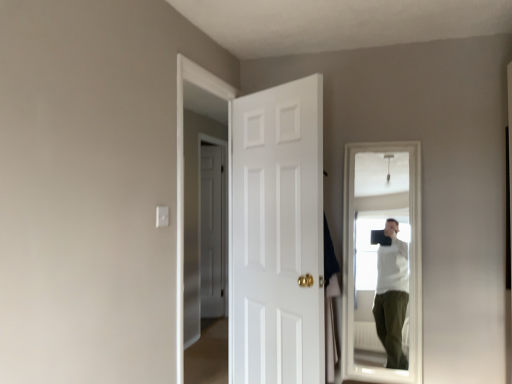
This screenshot has height=384, width=512. Find the location of `white painted wood door at center, which is counted as the first door, starting from the front`. white painted wood door at center, which is counted as the first door, starting from the front is located at coordinates (277, 236).

Describe the element at coordinates (277, 236) in the screenshot. I see `white painted wood door at center, which is the 2th door in back-to-front order` at that location.

How much space does white matte door at center, which is counted as the second door, starting from the right, occupy vertically?

It is 2.15 meters.

Describe the element at coordinates (213, 230) in the screenshot. I see `white matte door at center, the 1th door viewed from the left` at that location.

This screenshot has height=384, width=512. Identify the location of white matte door at center, the 2th door when ordered from front to back. (213, 230).

I want to click on white painted wood door at center, the 2th door in the left-to-right sequence, so tap(277, 236).

Which is more to the left, white matte door at center, which is counted as the second door, starting from the right, or white painted wood door at center, which is the 2th door in back-to-front order?

From the viewer's perspective, white matte door at center, which is counted as the second door, starting from the right, appears more on the left side.

From the picture: Is white matte door at center, the 1th door viewed from the left, further to camera compared to white painted wood door at center, which is counted as the first door, starting from the front?

Yes, white matte door at center, the 1th door viewed from the left, is further from the camera.

Does point (210, 316) come closer to viewer compared to point (300, 91)?

No.

From the image's perspective, does white matte door at center, the 2th door when ordered from front to back, appear higher than white painted wood door at center, which is the 1th door from right to left?

Incorrect, from the image's perspective, white matte door at center, the 2th door when ordered from front to back, is lower than white painted wood door at center, which is the 1th door from right to left.

Based on the photo, from a real-world perspective, is white matte door at center, which ranks as the first door in back-to-front order, positioned above or below white painted wood door at center, which is counted as the first door, starting from the front?

In terms of real-world spatial position, white matte door at center, which ranks as the first door in back-to-front order, is below white painted wood door at center, which is counted as the first door, starting from the front.

Can you confirm if white matte door at center, the 2th door when ordered from front to back, is wider than white painted wood door at center, which is the 2th door in back-to-front order?

Incorrect, the width of white matte door at center, the 2th door when ordered from front to back, does not surpass that of white painted wood door at center, which is the 2th door in back-to-front order.

Considering the sizes of white matte door at center, which ranks as the first door in back-to-front order, and white painted wood door at center, which is the 1th door from right to left, in the image, is white matte door at center, which ranks as the first door in back-to-front order, taller or shorter than white painted wood door at center, which is the 1th door from right to left,?

In the image, white matte door at center, which ranks as the first door in back-to-front order, appears to be taller than white painted wood door at center, which is the 1th door from right to left.

Can you confirm if white matte door at center, which is counted as the second door, starting from the right, is smaller than white painted wood door at center, which is the 2th door in back-to-front order?

Correct, white matte door at center, which is counted as the second door, starting from the right, occupies less space than white painted wood door at center, which is the 2th door in back-to-front order.

Do you think white matte door at center, which is counted as the second door, starting from the right, is within white painted wood door at center, which is the 1th door from right to left, or outside of it?

white matte door at center, which is counted as the second door, starting from the right, is not enclosed by white painted wood door at center, which is the 1th door from right to left.

Is white matte door at center, the 1th door viewed from the left, touching white painted wood door at center, the 2th door in the left-to-right sequence?

No, white matte door at center, the 1th door viewed from the left, is not in contact with white painted wood door at center, the 2th door in the left-to-right sequence.

Is white painted wood door at center, the 2th door in the left-to-right sequence, at the back of white matte door at center, which is counted as the second door, starting from the right?

white matte door at center, which is counted as the second door, starting from the right, is not turned away from white painted wood door at center, the 2th door in the left-to-right sequence.

Can you tell me how much white matte door at center, the 2th door when ordered from front to back, and white painted wood door at center, which is counted as the first door, starting from the front, differ in facing direction?

The facing directions of white matte door at center, the 2th door when ordered from front to back, and white painted wood door at center, which is counted as the first door, starting from the front, are 125 degrees apart.

The image size is (512, 384). Find the location of `door that is on the left side of white painted wood door at center, the 2th door in the left-to-right sequence`. door that is on the left side of white painted wood door at center, the 2th door in the left-to-right sequence is located at coordinates (213, 230).

Which is more to the left, white painted wood door at center, which is the 2th door in back-to-front order, or white matte door at center, which is counted as the second door, starting from the right?

white matte door at center, which is counted as the second door, starting from the right.

Between white painted wood door at center, which is the 1th door from right to left, and white matte door at center, which ranks as the first door in back-to-front order, which one is positioned in front?

Positioned in front is white painted wood door at center, which is the 1th door from right to left.

From the picture: Which point is more distant from viewer, (306, 305) or (224, 261)?

The point (224, 261) is behind.

From the image's perspective, is white painted wood door at center, the 2th door in the left-to-right sequence, positioned above or below white matte door at center, the 2th door when ordered from front to back?

Based on their image positions, white painted wood door at center, the 2th door in the left-to-right sequence, is located above white matte door at center, the 2th door when ordered from front to back.

From a real-world perspective, is white painted wood door at center, which is the 1th door from right to left, physically located above or below white matte door at center, the 2th door when ordered from front to back?

white painted wood door at center, which is the 1th door from right to left, is above white matte door at center, the 2th door when ordered from front to back.

In the scene shown: Is white painted wood door at center, which is the 1th door from right to left, thinner than white matte door at center, which ranks as the first door in back-to-front order?

Incorrect, the width of white painted wood door at center, which is the 1th door from right to left, is not less than that of white matte door at center, which ranks as the first door in back-to-front order.

Considering the sizes of white painted wood door at center, which is the 2th door in back-to-front order, and white matte door at center, which ranks as the first door in back-to-front order, in the image, is white painted wood door at center, which is the 2th door in back-to-front order, taller or shorter than white matte door at center, which ranks as the first door in back-to-front order,?

Considering their sizes, white painted wood door at center, which is the 2th door in back-to-front order, has less height than white matte door at center, which ranks as the first door in back-to-front order.

In the scene shown: Is white painted wood door at center, which is the 1th door from right to left, smaller than white matte door at center, which is counted as the second door, starting from the right?

Incorrect, white painted wood door at center, which is the 1th door from right to left, is not smaller in size than white matte door at center, which is counted as the second door, starting from the right.

Is white painted wood door at center, which is counted as the first door, starting from the front, situated inside white matte door at center, the 1th door viewed from the left, or outside?

white painted wood door at center, which is counted as the first door, starting from the front, is outside white matte door at center, the 1th door viewed from the left.

Looking at this image, is white painted wood door at center, which is the 1th door from right to left, far away from white matte door at center, the 1th door viewed from the left?

white painted wood door at center, which is the 1th door from right to left, is positioned a significant distance from white matte door at center, the 1th door viewed from the left.

Could you tell me if white painted wood door at center, which is counted as the first door, starting from the front, is facing white matte door at center, which is counted as the second door, starting from the right?

No, white painted wood door at center, which is counted as the first door, starting from the front, is not facing towards white matte door at center, which is counted as the second door, starting from the right.

How many degrees apart are the facing directions of white painted wood door at center, which is the 1th door from right to left, and white matte door at center, the 2th door when ordered from front to back?

There is a 125-degree angle between the facing directions of white painted wood door at center, which is the 1th door from right to left, and white matte door at center, the 2th door when ordered from front to back.

Measure the distance from white painted wood door at center, which is the 2th door in back-to-front order, to white matte door at center, which is counted as the second door, starting from the right.

6.21 feet.

Where is `door lying on the right of white matte door at center, the 2th door when ordered from front to back`? The image size is (512, 384). door lying on the right of white matte door at center, the 2th door when ordered from front to back is located at coordinates (277, 236).

You are a GUI agent. You are given a task and a screenshot of the screen. Output one action in this format:
    pyautogui.click(x=<x>, y=<y>)
    Task: Click on the door in front of the white matte door at center, the 2th door when ordered from front to back
    Image resolution: width=512 pixels, height=384 pixels.
    Given the screenshot: What is the action you would take?
    pyautogui.click(x=277, y=236)

Identify the location of door to the right of white matte door at center, which ranks as the first door in back-to-front order. (277, 236).